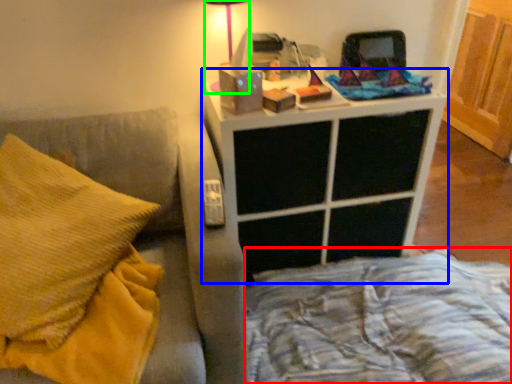
Question: Estimate the real-world distances between objects in this image. Which object is closer to bed frame (highlighted by a red box), nightstand (highlighted by a blue box) or table lamp (highlighted by a green box)?

Choices:
 (A) nightstand
 (B) table lamp

Answer: (A)